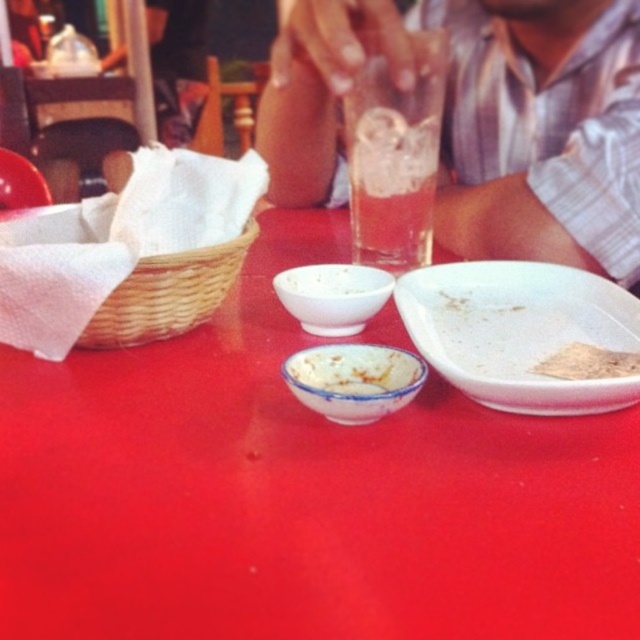
You are a waiter who needs to clear the dishes from the table. You see the white matte plate at center and the white glossy bowl at center. Which one should you pick up first if you want to start with the one closer to your right hand?

The white matte plate at center is to the right of white glossy bowl at center, so you should pick up the white matte plate at center first since it is closer to your right hand.

You are a waiter who needs to clean the table. You see the translucent glass beverage at center and the white powder at center. Which one should you remove first based on their sizes?

The translucent glass beverage at center is bigger than the white powder at center, so you should remove the translucent glass beverage at center first.